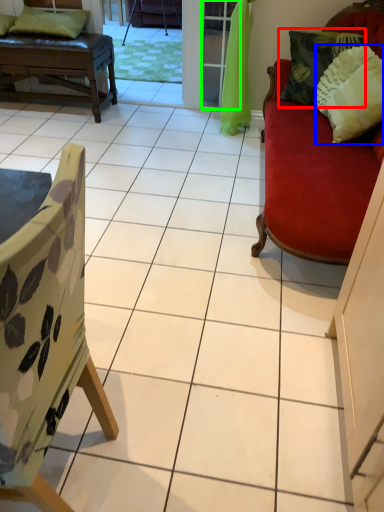
Question: Estimate the real-world distances between objects in this image. Which object is farther from pillow (highlighted by a red box), pillow (highlighted by a blue box) or screen door (highlighted by a green box)?

Choices:
 (A) pillow
 (B) screen door

Answer: (B)